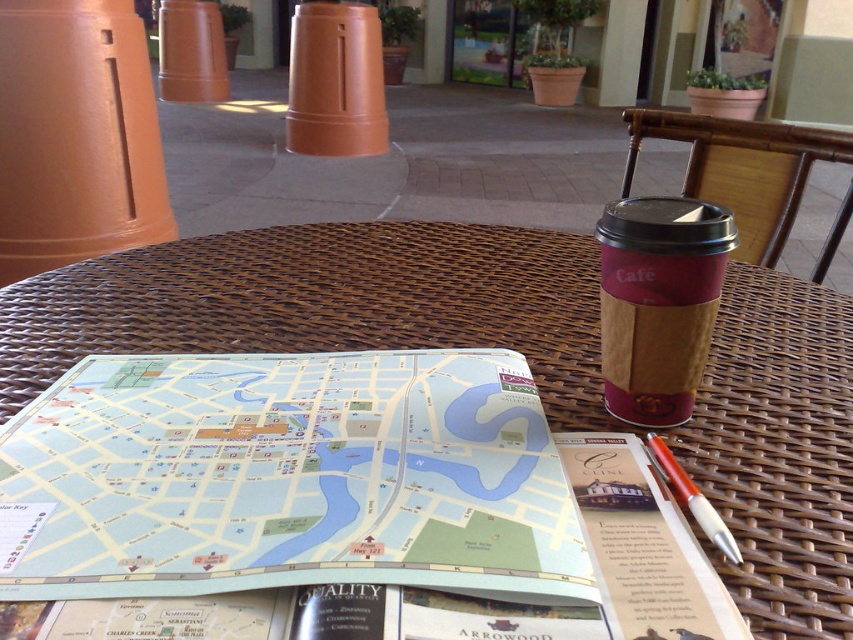
You are sitting at the brown wicker table at center and want to pick up the orange pen at right. Which direction should you reach towards?

You should reach towards the right side to pick up the orange pen at right since the brown wicker table at center is to the left of the orange pen at right.

You are holding a 12 inch ruler and want to place it on the brown wicker table at center. Can the ruler fit entirely on the table without overhanging?

The brown wicker table at center is 10.64 inches away from the viewer, but this distance does not indicate the table size. The question about the ruler fitting cannot be answered with the given information.

You are a tourist trying to locate the nearest park. You have a light blue paper map at center and an orange pen at right on the table. Which item is closer to the left edge of the table?

The light blue paper map at center is positioned on the left side of the orange pen at right, meaning it is closer to the left edge of the table.